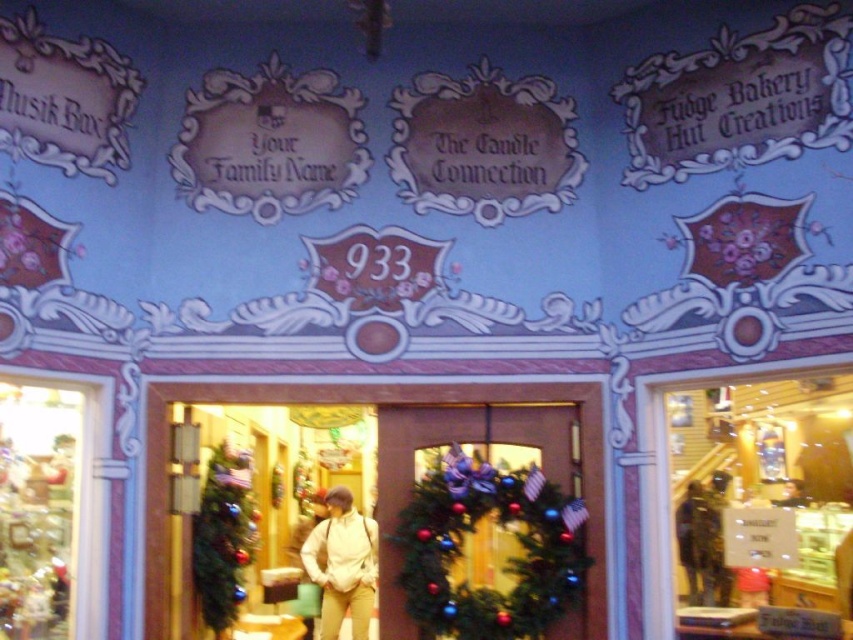
You are a customer standing at the entrance of the shop and see the translucent glass ornaments at left. Where exactly are they located in the image?

The translucent glass ornaments at left are located at point (50,509) in the image.

You are a delivery person carrying a large box that is 36 inches wide. You need to navigate through the entrance of the shop to deliver it to the back. Given the space between the translucent glass ornaments at left and the green matte christmas tree at lower left, will your box fit through this entrance without touching either object?

The distance between the translucent glass ornaments at left and the green matte christmas tree at lower left is 30.98 inches. Since your box is 36 inches wide, it is wider than the available space. Therefore, the box will not fit through the entrance without touching the objects.

You are a customer entering the shop and want to see both the translucent glass display case at right and the white matte jacket at center. Which object takes up more horizontal space in the entrance area?

The translucent glass display case at right is wider than the white matte jacket at center, so it takes up more horizontal space in the entrance area.